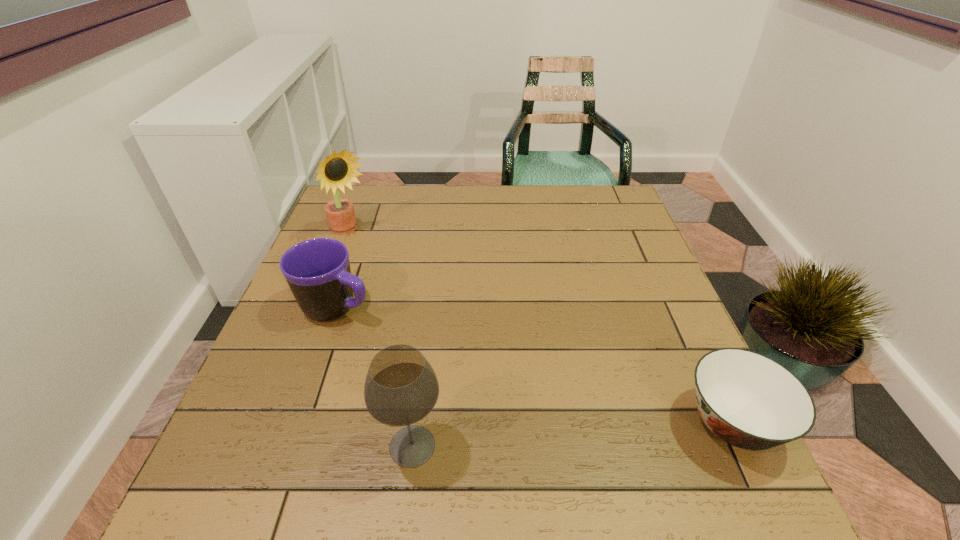
The width and height of the screenshot is (960, 540). In order to click on object positioned at the right edge in this screenshot , I will do `click(748, 400)`.

Where is `object at the far left corner`? This screenshot has height=540, width=960. object at the far left corner is located at coordinates (338, 170).

The width and height of the screenshot is (960, 540). Find the location of `object that is at the near right corner`. object that is at the near right corner is located at coordinates (748, 400).

In the image, there is a desktop. Where is `vacant region at the far edge`? The width and height of the screenshot is (960, 540). vacant region at the far edge is located at coordinates (398, 224).

In the image, there is a desktop. At what (x,y) coordinates should I click in order to perform the action: click on vacant area at the near edge. Please return your answer as a coordinate pair (x, y). The image size is (960, 540). Looking at the image, I should click on (363, 427).

The width and height of the screenshot is (960, 540). I want to click on vacant space at the left edge of the desktop, so click(x=363, y=266).

The image size is (960, 540). I want to click on vacant space at the right edge of the desktop, so click(636, 275).

The height and width of the screenshot is (540, 960). In the image, there is a desktop. Find the location of `vacant space at the far left corner`. vacant space at the far left corner is located at coordinates (379, 200).

The height and width of the screenshot is (540, 960). In the image, there is a desktop. Find the location of `vacant space at the near left corner`. vacant space at the near left corner is located at coordinates (300, 446).

In the image, there is a desktop. Find the location of `vacant space at the far right corner`. vacant space at the far right corner is located at coordinates (622, 194).